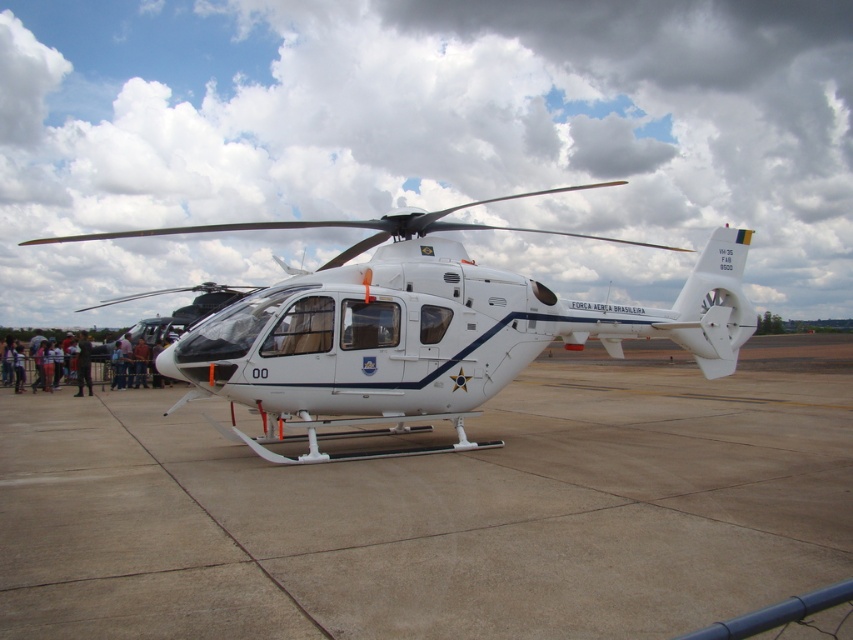
Does smooth concrete tarmac at center have a greater height compared to dark blue fabric pants at lower left?

Incorrect, smooth concrete tarmac at center's height is not larger of dark blue fabric pants at lower left's.

Identify the location of smooth concrete tarmac at center. The width and height of the screenshot is (853, 640). (440, 509).

This screenshot has height=640, width=853. What do you see at coordinates (440, 509) in the screenshot?
I see `smooth concrete tarmac at center` at bounding box center [440, 509].

Find the location of a particular element. This screenshot has height=640, width=853. smooth concrete tarmac at center is located at coordinates (440, 509).

Does point (100, 499) come farther from viewer compared to point (387, 412)?

That is False.

Does point (395, 566) come closer to viewer compared to point (311, 404)?

Yes, point (395, 566) is closer to viewer.

Find the location of a particular element. Image resolution: width=853 pixels, height=640 pixels. smooth concrete tarmac at center is located at coordinates (440, 509).

Is white matte helicopter at center thinner than dark blue fabric pants at lower left?

No, white matte helicopter at center is not thinner than dark blue fabric pants at lower left.

Does white matte helicopter at center come behind dark blue fabric pants at lower left?

No, it is not.

Locate an element on the screen. This screenshot has height=640, width=853. white matte helicopter at center is located at coordinates (422, 330).

Image resolution: width=853 pixels, height=640 pixels. What are the coordinates of `white matte helicopter at center` in the screenshot? It's located at (422, 330).